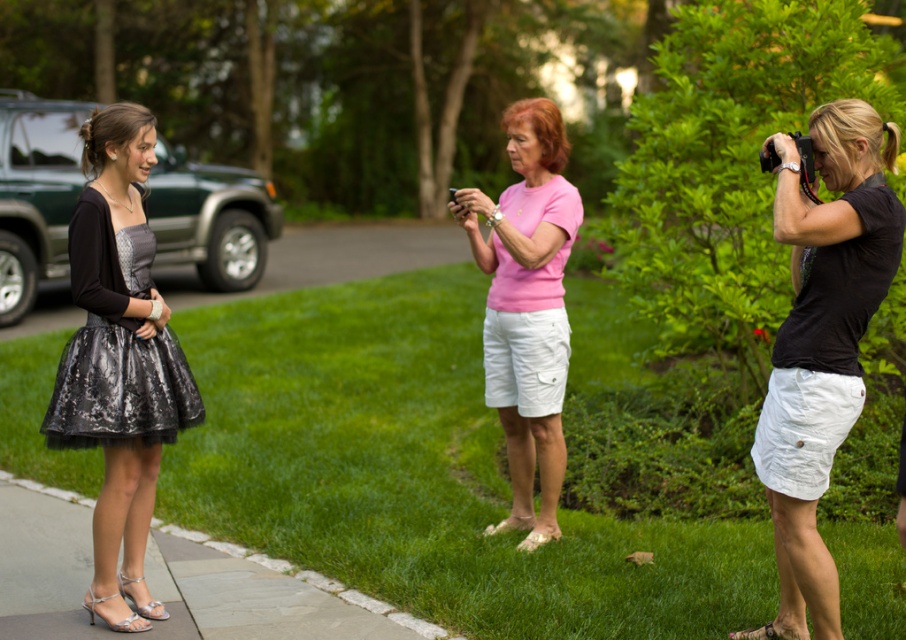
Between gray stone curb at lower left and pink matte shirt at center, which one has more height?

pink matte shirt at center

Does gray stone curb at lower left have a greater height compared to pink matte shirt at center?

In fact, gray stone curb at lower left may be shorter than pink matte shirt at center.

Find the location of `gray stone curb at lower left`. gray stone curb at lower left is located at coordinates (259, 598).

Image resolution: width=906 pixels, height=640 pixels. I want to click on gray stone curb at lower left, so click(x=259, y=598).

Who is positioned more to the right, pink matte shirt at center or shiny black dress at left?

Positioned to the right is pink matte shirt at center.

Based on the photo, can you confirm if pink matte shirt at center is positioned to the right of shiny black dress at left?

Yes, pink matte shirt at center is to the right of shiny black dress at left.

This screenshot has height=640, width=906. Identify the location of pink matte shirt at center. (526, 307).

Which is behind, point (275, 621) or point (100, 353)?

Point (275, 621)

Who is positioned more to the right, gray stone curb at lower left or shiny black dress at left?

shiny black dress at left is more to the right.

Is point (73, 548) in front of point (102, 316)?

No, it is behind (102, 316).

Locate an element on the screen. gray stone curb at lower left is located at coordinates (259, 598).